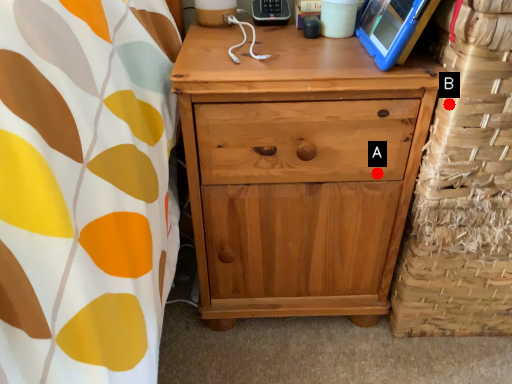
Question: Two points are circled on the image, labeled by A and B beside each circle. Which point appears farthest from the camera in this image?

Choices:
 (A) A is further
 (B) B is further

Answer: (A)